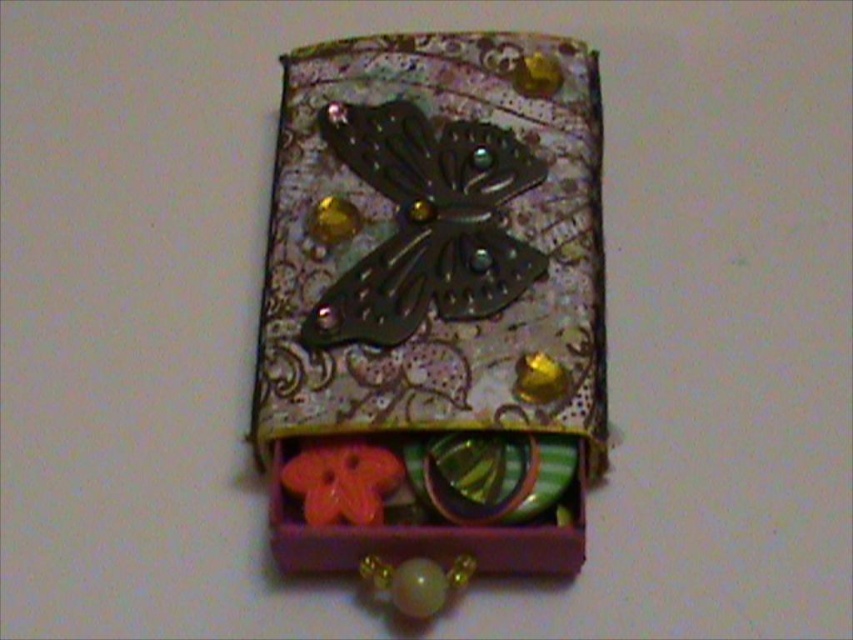
You are an interior designer arranging a display shelf and have both the metallic butterfly at center and the metallic dark brown butterfly at center. Which one should you choose if you want a larger decorative piece for the shelf?

The metallic butterfly at center has a larger size compared to the metallic dark brown butterfly at center, so you should choose the metallic butterfly at center for a larger decorative piece.

Consider the image. You are standing in front of the decorative box and want to place a small ornament at point (524, 285) and another at point (316, 524). Which point is closer to you?

Point (316, 524) is closer to you because point (524, 285) is behind it.

You are standing 1.45 meters away from the point at coordinates [386,104]. If you want to place a 1.2 meter long decorative box on the table, will it fit within the space available?

The point at coordinates [386,104] is 1.45 meters away from you. The decorative box is 1.2 meters long, so it should fit within the available space since the distance is greater than the box length.